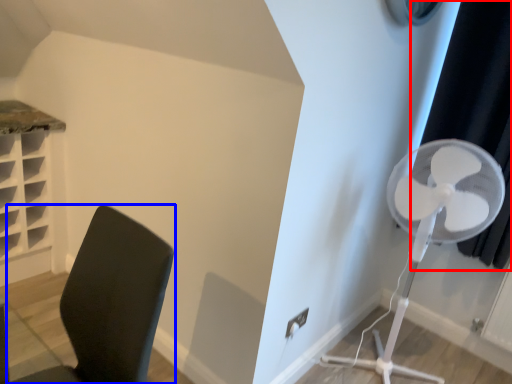
Question: Which point is closer to the camera, curtain (highlighted by a red box) or furniture (highlighted by a blue box)?

Choices:
 (A) curtain
 (B) furniture

Answer: (B)